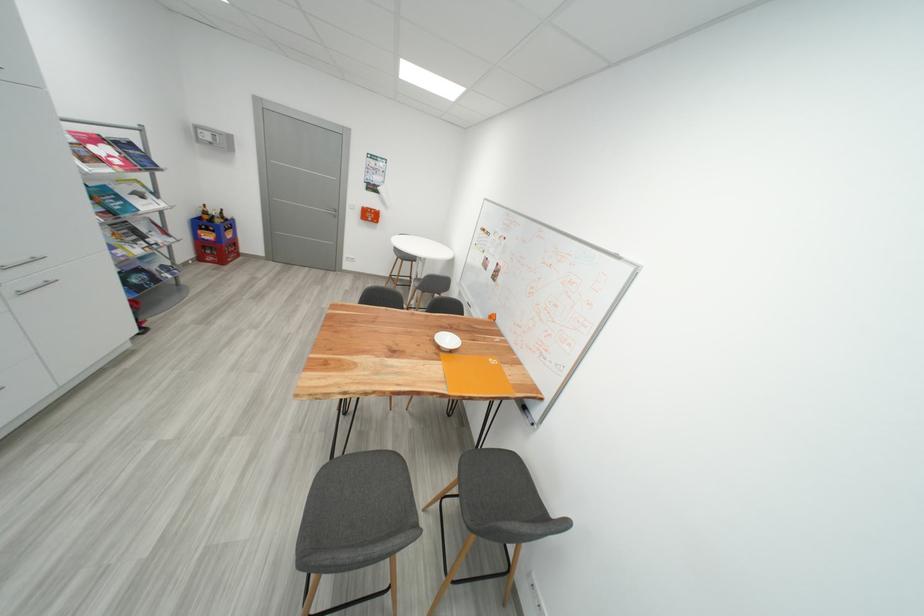
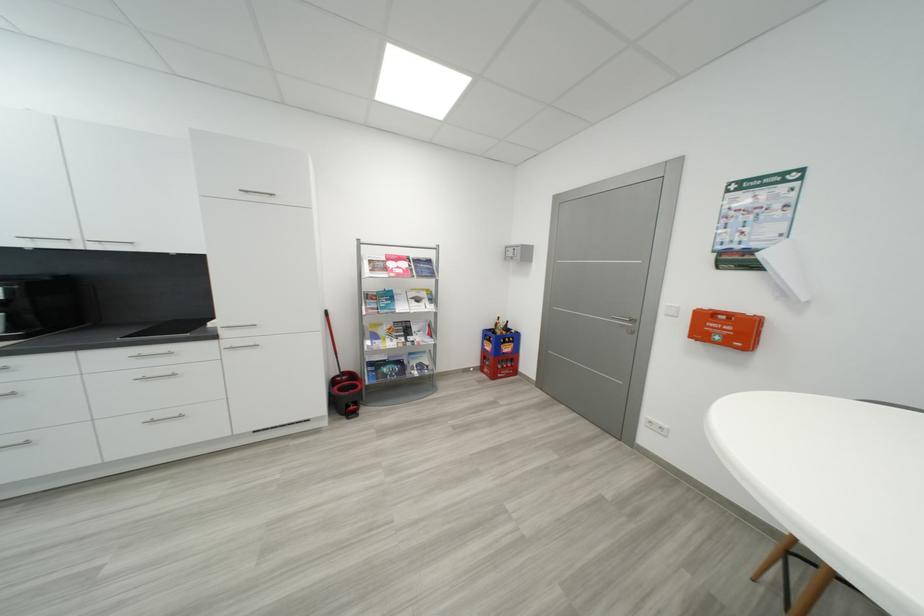
In the second image, find the point that corresponds to the point at 150,231 in the first image.

(421, 330)